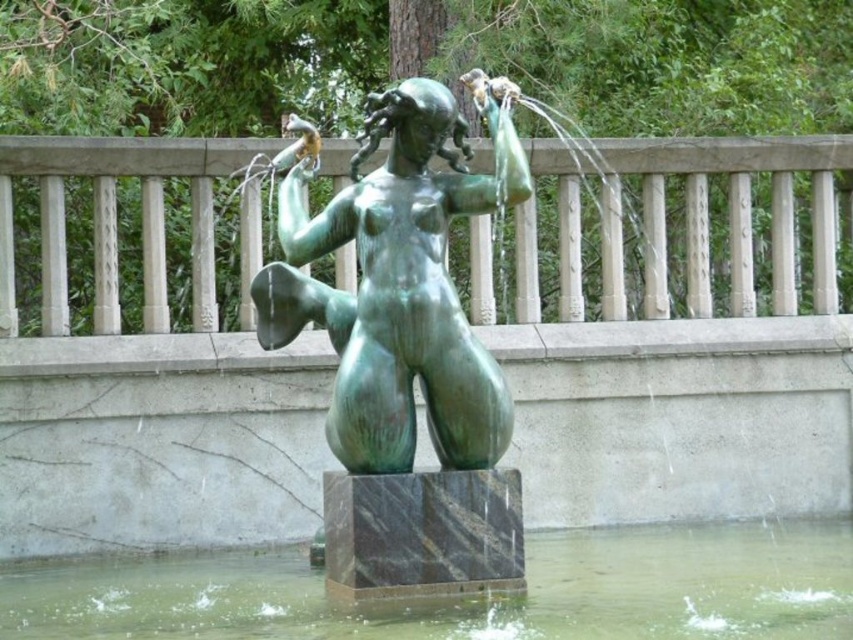
Can you confirm if greenish water at base center is smaller than green patina statue at center?

Yes.

Between point (753, 605) and point (363, 445), which one is positioned behind?

Positioned behind is point (753, 605).

Locate an element on the screen. greenish water at base center is located at coordinates (468, 602).

The image size is (853, 640). I want to click on greenish water at base center, so click(x=468, y=602).